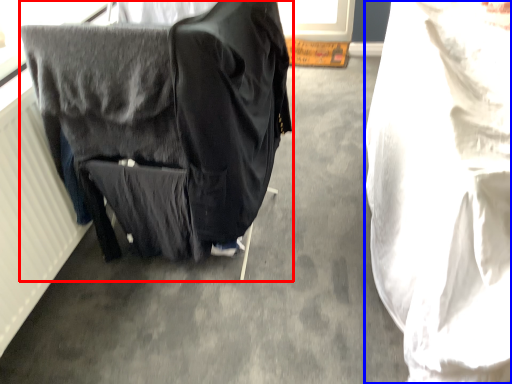
Question: Which object is closer to the camera taking this photo, furniture (highlighted by a red box) or sheet (highlighted by a blue box)?

Choices:
 (A) furniture
 (B) sheet

Answer: (B)